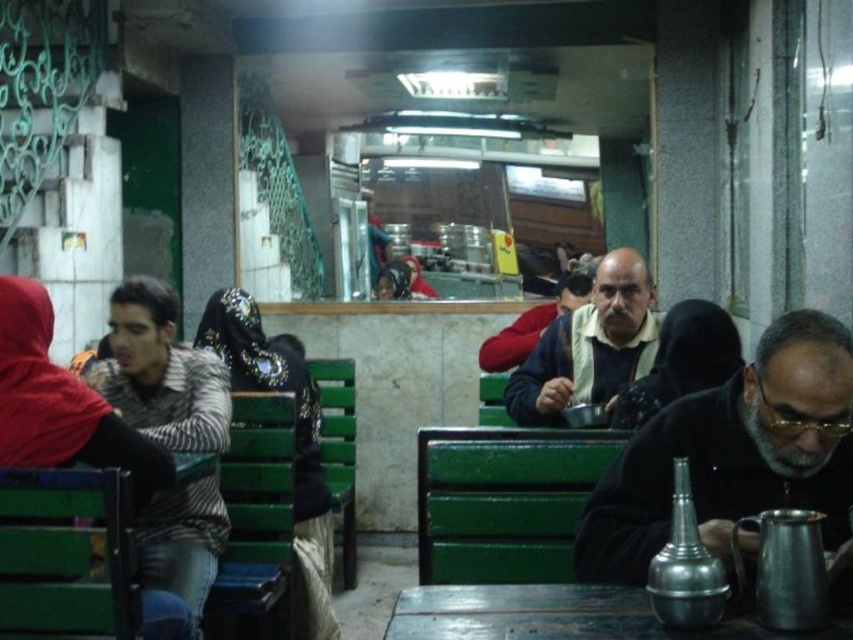
Question: Is striped fabric shirt at left further to camera compared to dark blue sweater at center?

Choices:
 (A) no
 (B) yes

Answer: (A)

Question: Does metallic silver teapot at right have a smaller size compared to metallic wooden table at center?

Choices:
 (A) no
 (B) yes

Answer: (A)

Question: Which object appears closest to the camera in this image?

Choices:
 (A) metallic silver teapot at right
 (B) striped fabric shirt at left

Answer: (A)

Question: Is dark blue shirt at center positioned at the back of dark blue sweater at center?

Choices:
 (A) yes
 (B) no

Answer: (B)

Question: Among these points, which one is nearest to the camera?

Choices:
 (A) pos(547,625)
 (B) pos(96,365)
 (C) pos(631,524)
 (D) pos(518,408)

Answer: (A)

Question: Considering the real-world distances, which object is closest to the metallic wooden table at center?

Choices:
 (A) dark blue shirt at center
 (B) dark blue sweater at center

Answer: (A)